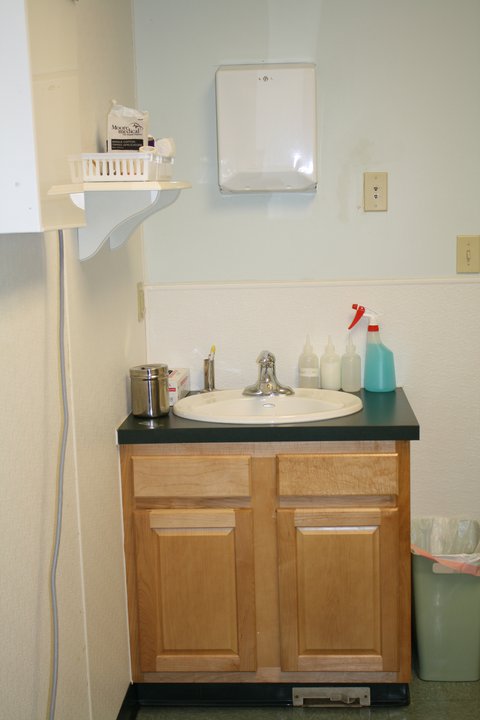
Locate an element on the screen. wall is located at coordinates (440, 487).